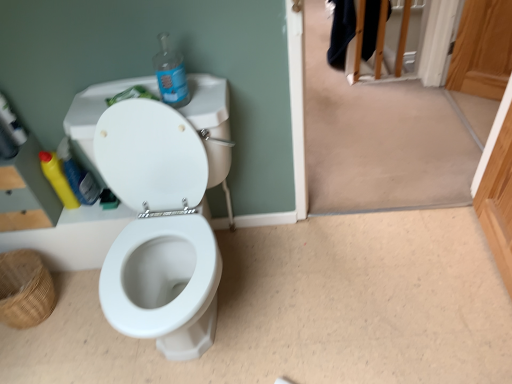
Image resolution: width=512 pixels, height=384 pixels. Identify the location of vacant space in front of yellow plastic bottle at left, which ranks as the second bottle in right-to-left order. (88, 215).